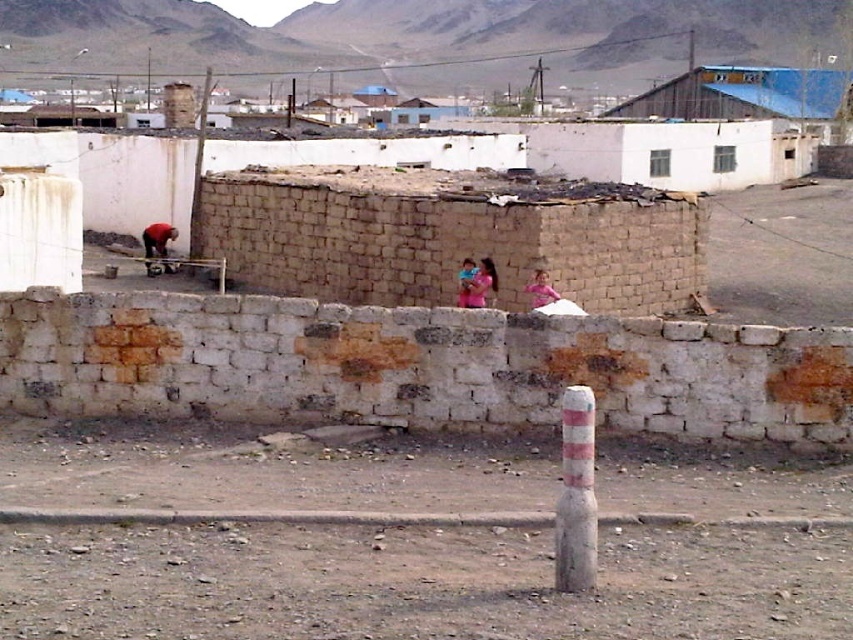
Who is more forward, (581, 481) or (157, 221)?

Point (581, 481) is in front.

Is white concrete pole at center positioned in front of red fabric shirt at left?

Yes.

Which is in front, point (592, 556) or point (155, 246)?

Positioned in front is point (592, 556).

This screenshot has width=853, height=640. In order to click on white concrete pole at center in this screenshot , I will do `click(576, 493)`.

Which is above, pink fabric at center or red fabric shirt at left?

red fabric shirt at left

Who is more forward, (480, 289) or (161, 224)?

Point (480, 289) is more forward.

In order to click on pink fabric at center in this screenshot , I will do `click(477, 285)`.

Between brown dirt field at center and blue corrugated metal hut at upper center, which one has less height?

With less height is brown dirt field at center.

Is point (531, 480) farther from camera compared to point (807, 68)?

No.

Image resolution: width=853 pixels, height=640 pixels. I want to click on brown dirt field at center, so click(x=408, y=536).